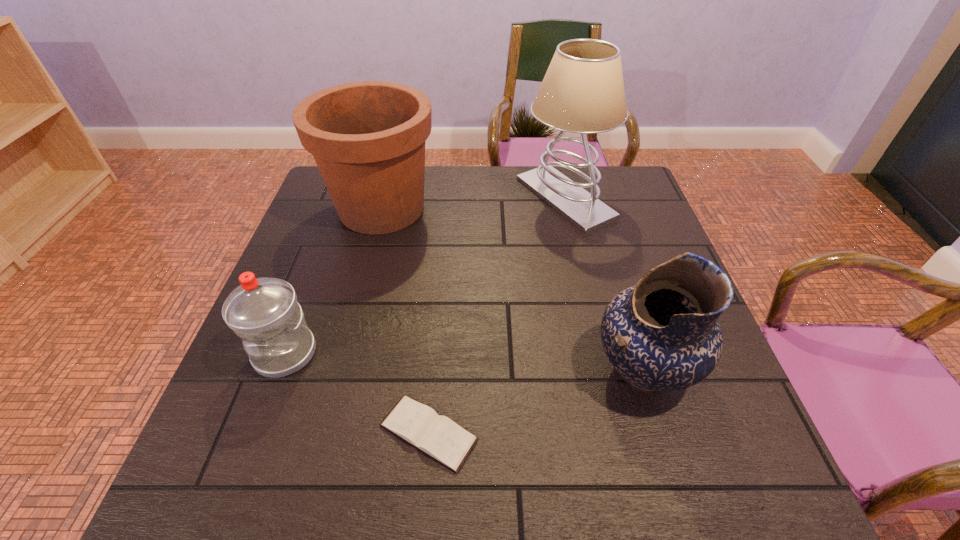
In order to click on free space between the tallest object and the water bottle in this screenshot , I will do `click(425, 276)`.

Where is `blank region between the flowerpot and the tallest object`? The image size is (960, 540). blank region between the flowerpot and the tallest object is located at coordinates (473, 204).

Find the location of a particular element. vacant space that's between the pottery and the shortest object is located at coordinates (536, 401).

What are the coordinates of `empty space between the table lamp and the diary` in the screenshot? It's located at (496, 315).

Where is `object that is the second closest to the pottery`? This screenshot has width=960, height=540. object that is the second closest to the pottery is located at coordinates (582, 92).

Point out which object is positioned as the fourth nearest to the shortest object. Please provide its 2D coordinates. Your answer should be formatted as a tuple, i.e. [(x, y)], where the tuple contains the x and y coordinates of a point satisfying the conditions above.

[(582, 92)]

Where is `vacant position in the image that satisfies the following two spatial constraints: 1. on the handle side of the water bottle; 2. on the left side of the pottery`? This screenshot has height=540, width=960. vacant position in the image that satisfies the following two spatial constraints: 1. on the handle side of the water bottle; 2. on the left side of the pottery is located at coordinates 279,370.

This screenshot has height=540, width=960. In order to click on free space in the image that satisfies the following two spatial constraints: 1. on the handle side of the pottery; 2. on the right side of the fourth tallest object in this screenshot , I will do `click(279, 370)`.